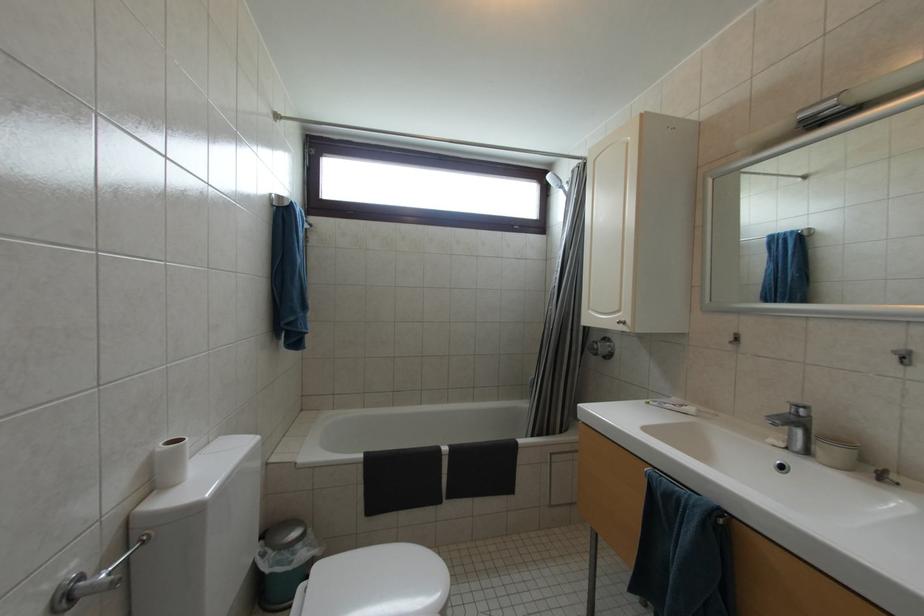
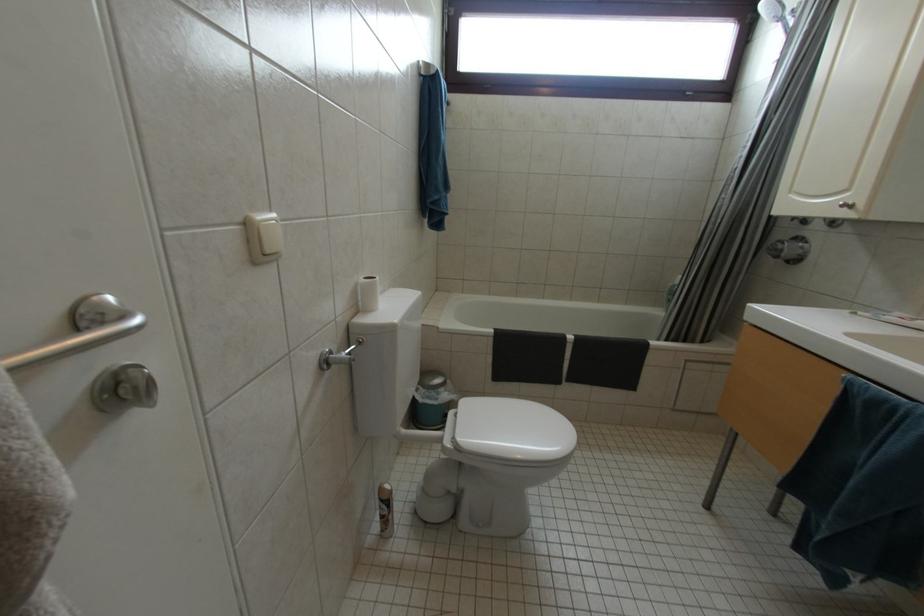
Question: Which direction would the cameraman need to move to produce the second image? Reply with the corresponding letter.

Choices:
 (A) Left
 (B) Right
 (C) Forward
 (D) Backward

Answer: (A)